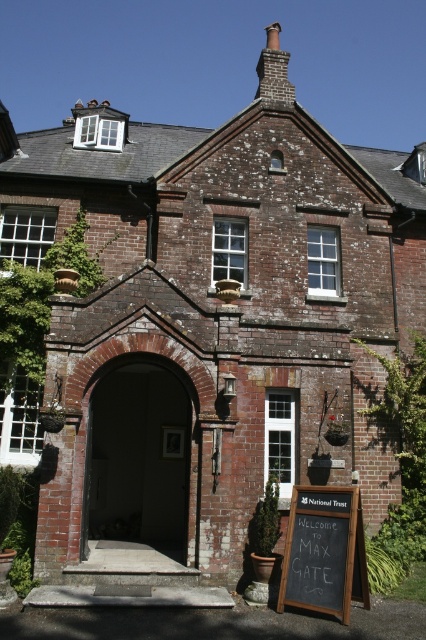
You are standing in front of the traditional brick building and want to place a new sign on the wall between the brick archway at center and the black chalkboard at lower right. Based on their positions, which object should the sign be closer to?

The brick archway at center is positioned on the left side of black chalkboard at lower right, so the sign should be placed closer to the black chalkboard at lower right since it is on the right side of the archway.

You are standing in front of the traditional brick building and want to walk towards the brick archway at center and the black chalkboard at lower right. Which object will you reach first?

You will reach the brick archway at center first because it is closer to you than the black chalkboard at lower right, which is further away.